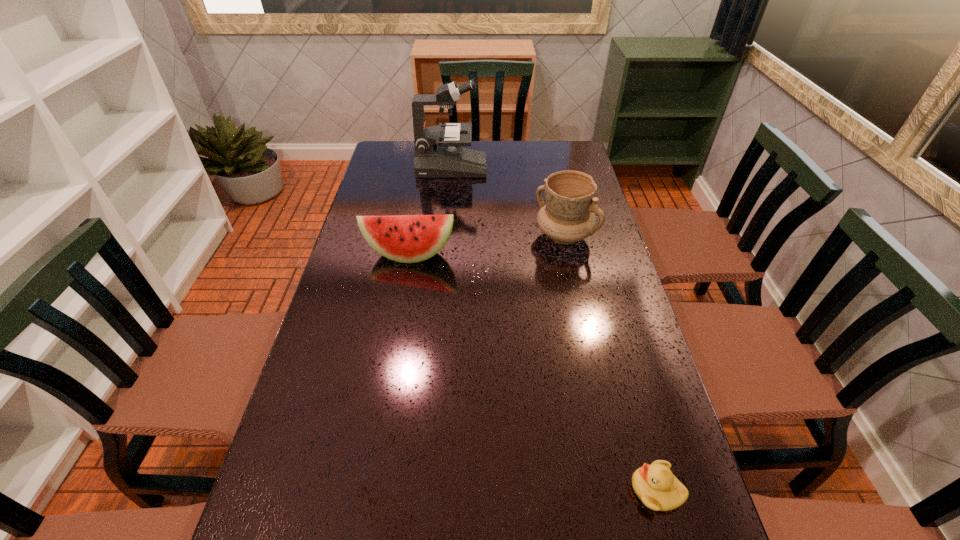
Image resolution: width=960 pixels, height=540 pixels. What are the coordinates of `free space in the image that satisfies the following two spatial constraints: 1. through the eyepieces of the tallest object; 2. on the outer rind of the second shortest object` in the screenshot? It's located at (444, 254).

Identify the location of vacant area in the image that satisfies the following two spatial constraints: 1. through the eyepieces of the tallest object; 2. on the outer rind of the second shortest object. This screenshot has height=540, width=960. (444, 254).

You are a GUI agent. You are given a task and a screenshot of the screen. Output one action in this format:
    pyautogui.click(x=<x>, y=<y>)
    Task: Click on the free spot that satisfies the following two spatial constraints: 1. through the eyepieces of the tallest object; 2. on the right side of the second tallest object
    This screenshot has width=960, height=540.
    Given the screenshot: What is the action you would take?
    tap(445, 235)